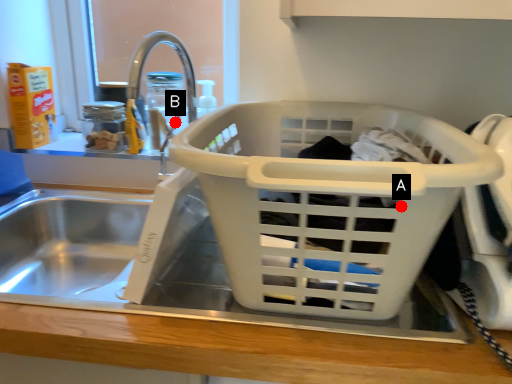
Question: Two points are circled on the image, labeled by A and B beside each circle. Among these points, which one is nearest to the camera?

Choices:
 (A) A is closer
 (B) B is closer

Answer: (A)